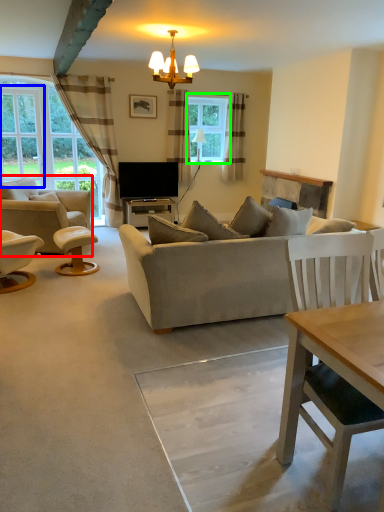
Question: Which object is positioned closest to chair (highlighted by a red box)? Select from window screen (highlighted by a blue box) and window (highlighted by a green box).

Choices:
 (A) window screen
 (B) window

Answer: (A)